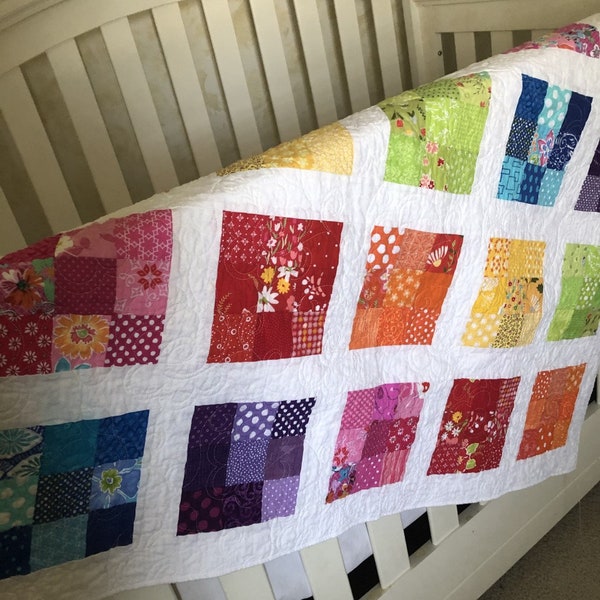
The width and height of the screenshot is (600, 600). Identify the location of quilt. (371, 199).